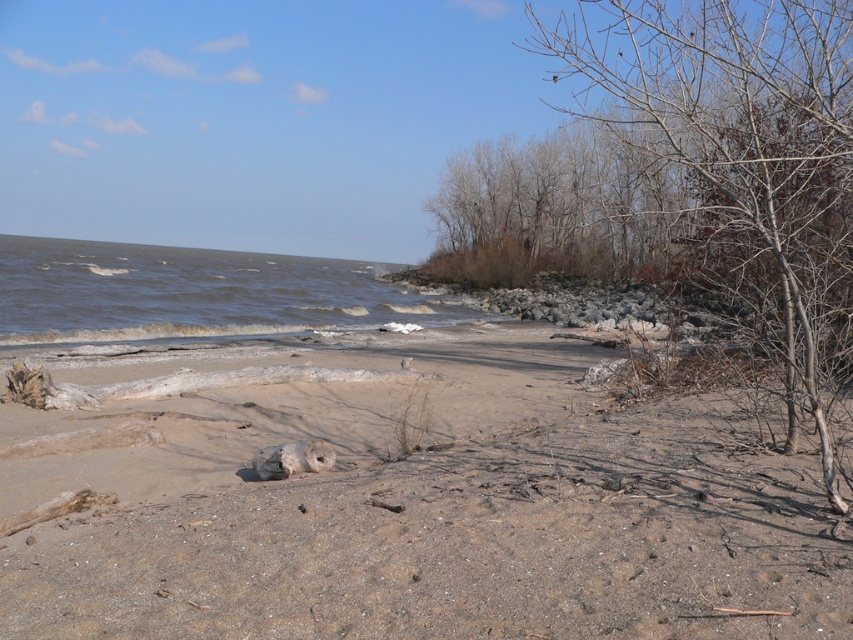
You are standing on the beach and see the bare branches at right and the dark gray water at lower left. Which object is closer to you?

The bare branches at right is closer to you because it is in front of the dark gray water at lower left.

You are standing on the beach and notice two elements in the scene. One is the bare branches at right and the other is the dark gray water at lower left. Which of these two objects takes up more space in the image?

The bare branches at right takes up more space in the image than the dark gray water at lower left because it is larger in size.